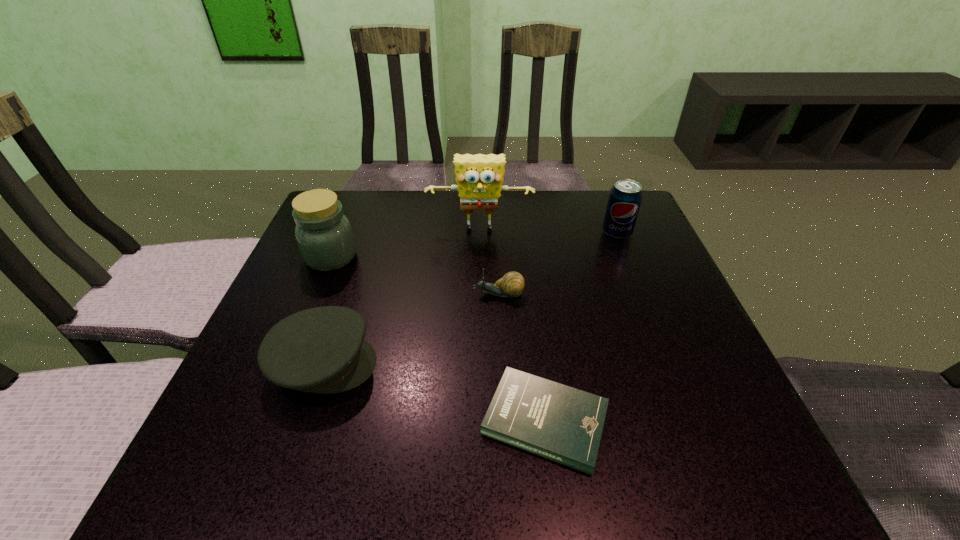
The width and height of the screenshot is (960, 540). Find the location of `free space between the book and the second shortest object`. free space between the book and the second shortest object is located at coordinates (522, 357).

Where is `free area in between the third tallest object and the sponge`? This screenshot has height=540, width=960. free area in between the third tallest object and the sponge is located at coordinates (x=548, y=232).

The image size is (960, 540). Identify the location of vacant area that lies between the sponge and the rightmost object. (548, 232).

Find the location of `vacant space that is in between the jar and the fourth shortest object`. vacant space that is in between the jar and the fourth shortest object is located at coordinates 474,245.

Where is `vacant area that lies between the fourth tallest object and the sponge`? The width and height of the screenshot is (960, 540). vacant area that lies between the fourth tallest object and the sponge is located at coordinates (401, 297).

The image size is (960, 540). Find the location of `vacant space that's between the book and the tallest object`. vacant space that's between the book and the tallest object is located at coordinates (513, 325).

Where is `blank region between the fourth tallest object and the rightmost object`? blank region between the fourth tallest object and the rightmost object is located at coordinates [470, 299].

Identify the location of free area in between the shortest object and the jar. Image resolution: width=960 pixels, height=540 pixels. pyautogui.click(x=438, y=339).

The image size is (960, 540). I want to click on object identified as the third closest to the soda can, so click(564, 424).

Point out which object is positioned as the fifth nearest to the book. Please provide its 2D coordinates. Your answer should be formatted as a tuple, i.e. [(x, y)], where the tuple contains the x and y coordinates of a point satisfying the conditions above.

[(625, 197)]